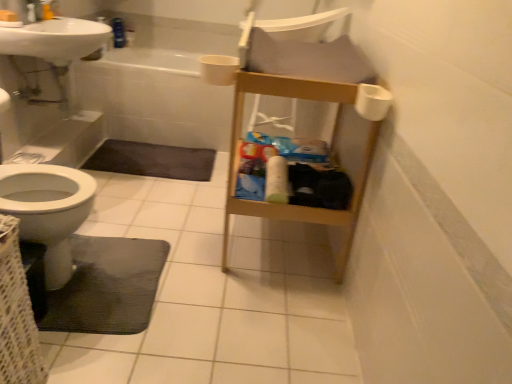
Question: From a real-world perspective, is white glossy sink at upper left above or below woven fabric basket at lower left?

Choices:
 (A) above
 (B) below

Answer: (A)

Question: Is white glossy sink at upper left taller or shorter than woven fabric basket at lower left?

Choices:
 (A) tall
 (B) short

Answer: (B)

Question: Based on their relative distances, which object is farther from the white glossy sink at upper left?

Choices:
 (A) white matte toilet paper at center, the 1th toilet paper positioned from the back
 (B) dark gray matte bath mat at lower left, which appears as the second bath mat when ordered from the bottom
 (C) white matte toilet paper at upper right, placed as the 2th toilet paper when sorted from bottom to top
 (D) white glossy bathtub at upper center
 (E) black rubber bath mat at lower left, which is the 1th bath mat in front-to-back order

Answer: (C)

Question: Which object is positioned farthest from the white matte toilet paper at center, the 1th toilet paper positioned from the back?

Choices:
 (A) woven fabric basket at lower left
 (B) white glossy bathtub at upper center
 (C) white glossy sink at upper left
 (D) black rubber bath mat at lower left, which is the 1th bath mat in front-to-back order
 (E) white matte toilet paper at upper right, the first toilet paper positioned from the front

Answer: (C)